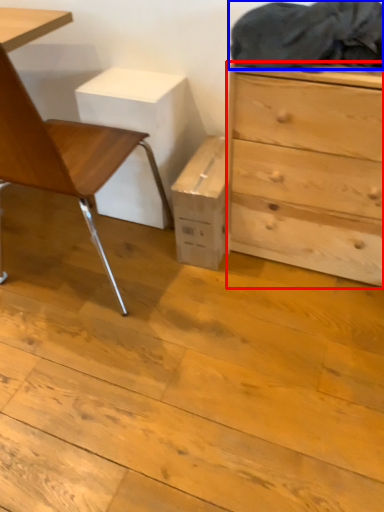
Question: Which point is further to the camera, chest of drawers (highlighted by a red box) or laundry (highlighted by a blue box)?

Choices:
 (A) chest of drawers
 (B) laundry

Answer: (A)